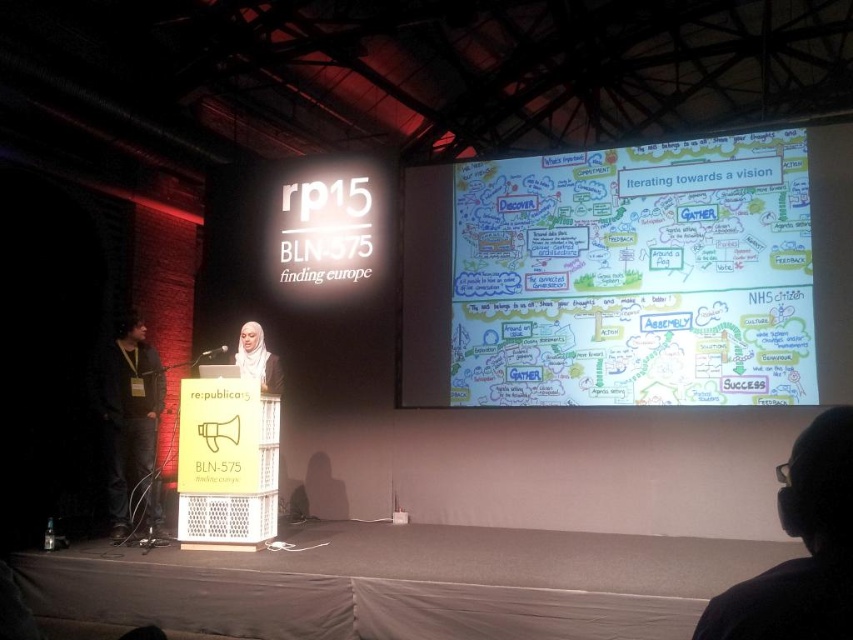
This screenshot has height=640, width=853. What do you see at coordinates (621, 272) in the screenshot?
I see `white paperboard at upper center` at bounding box center [621, 272].

Who is more distant from viewer, [453,376] or [271,356]?

The point [453,376] is more distant.

Does point (772, 140) come behind point (238, 352)?

That is True.

Find the location of a particular element. This screenshot has height=640, width=853. white paperboard at upper center is located at coordinates (621, 272).

From the picture: Between white paperboard at upper center and black fabric at left, which one appears on the left side from the viewer's perspective?

From the viewer's perspective, black fabric at left appears more on the left side.

Does white paperboard at upper center have a smaller size compared to black fabric at left?

No, white paperboard at upper center is not smaller than black fabric at left.

The width and height of the screenshot is (853, 640). What do you see at coordinates (621, 272) in the screenshot?
I see `white paperboard at upper center` at bounding box center [621, 272].

Identify the location of white paperboard at upper center. (621, 272).

Between black fabric at left and matte white hijab at center, which one appears on the left side from the viewer's perspective?

black fabric at left is more to the left.

How far apart are black fabric at left and matte white hijab at center?

95.95 centimeters

Describe the element at coordinates (131, 420) in the screenshot. This screenshot has width=853, height=640. I see `black fabric at left` at that location.

You are a GUI agent. You are given a task and a screenshot of the screen. Output one action in this format:
    pyautogui.click(x=<x>, y=<y>)
    Task: Click on the black fabric at left
    Image resolution: width=853 pixels, height=640 pixels.
    Given the screenshot: What is the action you would take?
    pyautogui.click(x=131, y=420)